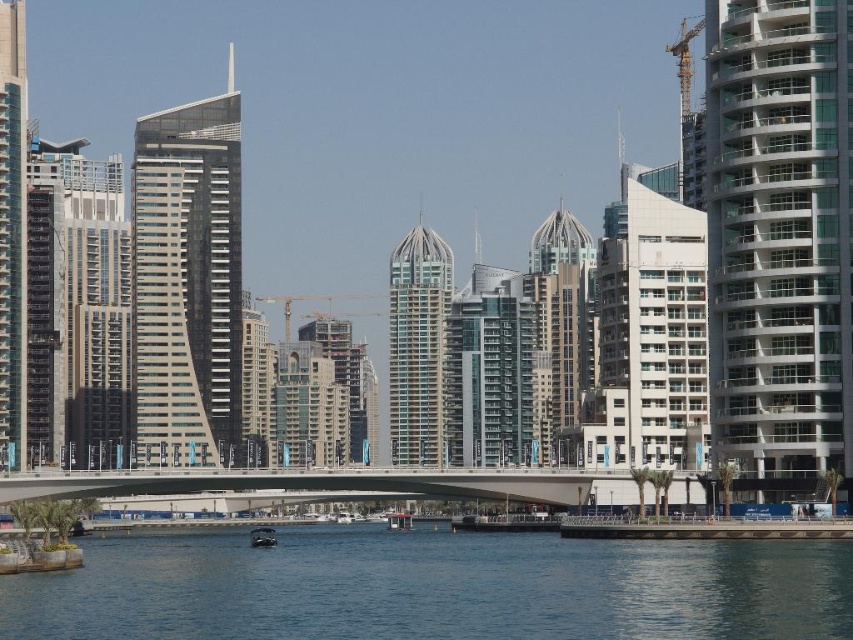
You are an architect designing a new observation deck overlooking the blue water at lower center and the yellow metallic crane at upper right. Which object will appear larger in the design blueprint if they are drawn to scale?

The yellow metallic crane at upper right will appear larger in the design blueprint because it occupies more space than the blue water at lower center according to the provided description.

Based on the photo, you are standing at the point marked by coordinates point (434,588). Looking around, what do you see in the immediate vicinity of your location?

The point (434,588) indicates blue water at lower center, so you are standing at the blue water at lower center.

Based on the photo, you are a photographer standing on the dock and want to capture both the blue water at lower center and the yellow metallic crane at upper right in the same frame. Based on their positions, which object should you adjust your camera to focus on first to ensure both are in the shot?

Since the blue water at lower center is to the left of the yellow metallic crane at upper right, you should focus on the blue water at lower center first as it is positioned further left, allowing you to frame both objects by adjusting the camera from left to right.